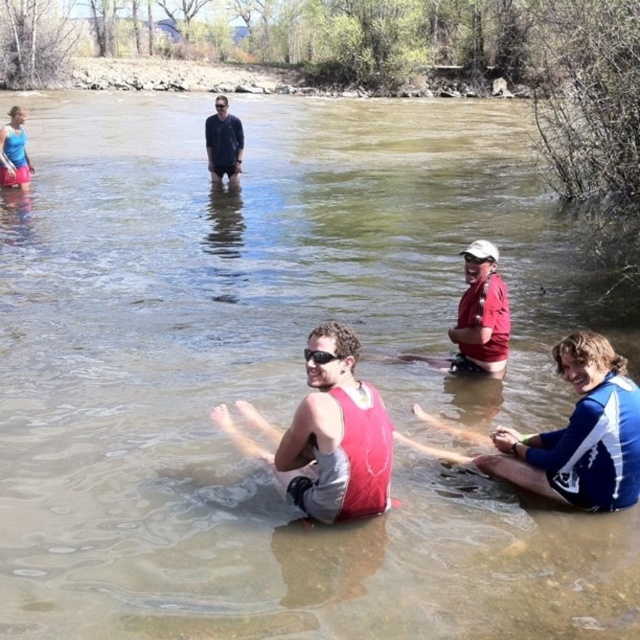
Question: Which object is farther from the camera taking this photo?

Choices:
 (A) matte red shirt at center
 (B) matte blue tank top at upper left
 (C) clear plastic goggles at center
 (D) transparent plastic goggles at center

Answer: (D)

Question: Is matte blue tank top at upper left positioned in front of transparent plastic goggles at center?

Choices:
 (A) yes
 (B) no

Answer: (A)

Question: Which object appears farthest from the camera in this image?

Choices:
 (A) blue and white jersey at lower right
 (B) black smooth shirt at upper center

Answer: (B)

Question: In this image, where is matte red shirt at center located relative to white matte goggles at center?

Choices:
 (A) below
 (B) above

Answer: (A)

Question: Can you confirm if matte red shirt at center is smaller than clear plastic goggles at center?

Choices:
 (A) no
 (B) yes

Answer: (A)

Question: Based on their relative distances, which object is nearer to the white matte goggles at center?

Choices:
 (A) black smooth shirt at upper center
 (B) transparent plastic goggles at center
 (C) matte red shirt at center
 (D) matte red tank top at center

Answer: (C)